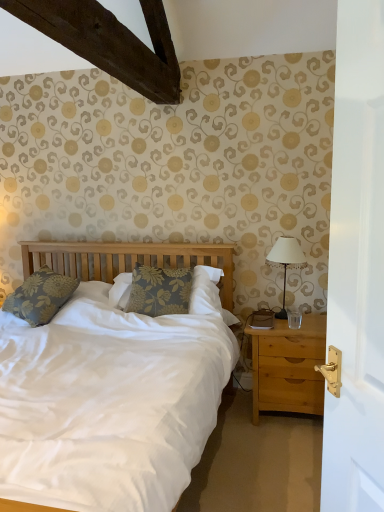
The height and width of the screenshot is (512, 384). Find the location of `floral fabric pillow at center, marked as the 2th pillow in a left-to-right arrangement`. floral fabric pillow at center, marked as the 2th pillow in a left-to-right arrangement is located at coordinates (157, 289).

What do you see at coordinates (40, 296) in the screenshot? The image size is (384, 512). I see `floral fabric pillow at left, which is counted as the first pillow, starting from the left` at bounding box center [40, 296].

This screenshot has height=512, width=384. What are the coordinates of `light brown wood nightstand at right` in the screenshot? It's located at [x=289, y=367].

Is transparent glass at right aimed at white fabric-covered lamp at right?

No, transparent glass at right is not turned towards white fabric-covered lamp at right.

How many degrees apart are the facing directions of transparent glass at right and white fabric-covered lamp at right?

3.47 degrees separate the facing orientations of transparent glass at right and white fabric-covered lamp at right.

Is transparent glass at right bigger than white fabric-covered lamp at right?

No.

Between point (294, 327) and point (295, 247), which one is positioned behind?

Point (295, 247)

Does floral fabric pillow at center, the 1th pillow from the right, have a lesser height compared to light brown wood nightstand at right?

Yes.

Considering the points (207, 272) and (293, 380), which point is behind, point (207, 272) or point (293, 380)?

The point (207, 272) is more distant.

Looking at this image, considering the positions of objects floral fabric pillow at center, marked as the 2th pillow in a left-to-right arrangement, and light brown wood nightstand at right in the image provided, who is more to the left, floral fabric pillow at center, marked as the 2th pillow in a left-to-right arrangement, or light brown wood nightstand at right?

From the viewer's perspective, floral fabric pillow at center, marked as the 2th pillow in a left-to-right arrangement, appears more on the left side.

From the image's perspective, which is below, floral fabric pillow at center, marked as the 2th pillow in a left-to-right arrangement, or light brown wood nightstand at right?

light brown wood nightstand at right is shown below in the image.

Are light brown wood nightstand at right and floral fabric pillow at center, marked as the 2th pillow in a left-to-right arrangement, beside each other?

No.

Is light brown wood nightstand at right thinner than floral fabric pillow at center, the 1th pillow from the right?

Incorrect, the width of light brown wood nightstand at right is not less than that of floral fabric pillow at center, the 1th pillow from the right.

From the image's perspective, which is below, light brown wood nightstand at right or floral fabric pillow at center, marked as the 2th pillow in a left-to-right arrangement?

light brown wood nightstand at right appears lower in the image.

Between light brown wood nightstand at right and floral fabric pillow at center, the 1th pillow from the right, which one is positioned behind?

floral fabric pillow at center, the 1th pillow from the right, is further away from the camera.

Is floral fabric pillow at left, the second pillow positioned from the right, positioned before white fabric-covered lamp at right?

Yes, floral fabric pillow at left, the second pillow positioned from the right, is closer to the camera.

How distant is floral fabric pillow at left, the second pillow positioned from the right, from white fabric-covered lamp at right?

floral fabric pillow at left, the second pillow positioned from the right, and white fabric-covered lamp at right are 1.45 meters apart from each other.

From the image's perspective, is floral fabric pillow at left, the second pillow positioned from the right, on top of white fabric-covered lamp at right?

No, from the image's perspective, floral fabric pillow at left, the second pillow positioned from the right, is not on top of white fabric-covered lamp at right.

Is white fabric-covered lamp at right located within floral fabric pillow at left, which is counted as the first pillow, starting from the left?

No, white fabric-covered lamp at right is not surrounded by floral fabric pillow at left, which is counted as the first pillow, starting from the left.

Consider the image. Is floral fabric pillow at left, the second pillow positioned from the right, smaller than light brown wood nightstand at right?

Yes.

From a real-world perspective, is floral fabric pillow at left, which is counted as the first pillow, starting from the left, below light brown wood nightstand at right?

No, from a real-world perspective, floral fabric pillow at left, which is counted as the first pillow, starting from the left, is not below light brown wood nightstand at right.

Based on the photo, measure the distance between floral fabric pillow at left, which is counted as the first pillow, starting from the left, and light brown wood nightstand at right.

They are 1.41 meters apart.

Which of these two, floral fabric pillow at left, the second pillow positioned from the right, or light brown wood nightstand at right, stands shorter?

floral fabric pillow at left, the second pillow positioned from the right, is shorter.

Is transparent glass at right placed right next to light brown wood nightstand at right?

There is a gap between transparent glass at right and light brown wood nightstand at right.

Based on the photo, how distant is transparent glass at right from light brown wood nightstand at right?

The distance of transparent glass at right from light brown wood nightstand at right is 9.70 inches.

Between transparent glass at right and light brown wood nightstand at right, which one has smaller size?

transparent glass at right.

Is point (289, 309) closer to viewer compared to point (295, 374)?

No.

From the image's perspective, is transparent glass at right located above or below floral fabric pillow at center, the 1th pillow from the right?

Clearly, from the image's perspective, transparent glass at right is below floral fabric pillow at center, the 1th pillow from the right.

Is transparent glass at right inside the boundaries of floral fabric pillow at center, the 1th pillow from the right, or outside?

transparent glass at right is not inside floral fabric pillow at center, the 1th pillow from the right, it's outside.

Where is `bedside lamp behind the transparent glass at right`? This screenshot has width=384, height=512. bedside lamp behind the transparent glass at right is located at coordinates (286, 262).

From the image's perspective, starting from the light brown wood nightstand at right, which pillow is the 2nd one above? Please provide its 2D coordinates.

[(157, 289)]

Which object lies further to the anchor point floral fabric pillow at left, the second pillow positioned from the right, white fabric-covered lamp at right or transparent glass at right?

transparent glass at right is further to floral fabric pillow at left, the second pillow positioned from the right.

Looking at this image, looking at the image, which one is located further to floral fabric pillow at left, the second pillow positioned from the right, white fabric-covered lamp at right or light brown wood nightstand at right?

Based on the image, white fabric-covered lamp at right appears to be further to floral fabric pillow at left, the second pillow positioned from the right.

Looking at this image, based on their spatial positions, is floral fabric pillow at left, which is counted as the first pillow, starting from the left, or floral fabric pillow at center, marked as the 2th pillow in a left-to-right arrangement, further from white fabric-covered lamp at right?

The object further to white fabric-covered lamp at right is floral fabric pillow at left, which is counted as the first pillow, starting from the left.

Which object lies nearer to the anchor point white fabric-covered lamp at right, floral fabric pillow at center, marked as the 2th pillow in a left-to-right arrangement, or light brown wood nightstand at right?

light brown wood nightstand at right is closer to white fabric-covered lamp at right.

Looking at the image, which one is located further to transparent glass at right, floral fabric pillow at center, the 1th pillow from the right, or floral fabric pillow at left, the second pillow positioned from the right?

floral fabric pillow at left, the second pillow positioned from the right.

Estimate the real-world distances between objects in this image. Which object is further from white fabric-covered lamp at right, light brown wood nightstand at right or transparent glass at right?

Among the two, light brown wood nightstand at right is located further to white fabric-covered lamp at right.

Looking at the image, which one is located further to white fabric-covered lamp at right, floral fabric pillow at left, the second pillow positioned from the right, or transparent glass at right?

floral fabric pillow at left, the second pillow positioned from the right, is positioned further to the anchor white fabric-covered lamp at right.

Which object lies nearer to the anchor point floral fabric pillow at center, the 1th pillow from the right, white fabric-covered lamp at right or light brown wood nightstand at right?

Among the two, light brown wood nightstand at right is located nearer to floral fabric pillow at center, the 1th pillow from the right.

The height and width of the screenshot is (512, 384). I want to click on pillow located between floral fabric pillow at left, the second pillow positioned from the right, and transparent glass at right in the left-right direction, so click(157, 289).

This screenshot has height=512, width=384. In order to click on pillow between floral fabric pillow at left, which is counted as the first pillow, starting from the left, and white fabric-covered lamp at right from left to right in this screenshot , I will do `click(157, 289)`.

Locate an element on the screen. Image resolution: width=384 pixels, height=512 pixels. pillow between floral fabric pillow at left, which is counted as the first pillow, starting from the left, and light brown wood nightstand at right from left to right is located at coordinates (157, 289).

Locate an element on the screen. The image size is (384, 512). bedside lamp located between floral fabric pillow at left, the second pillow positioned from the right, and light brown wood nightstand at right in the left-right direction is located at coordinates (286, 262).